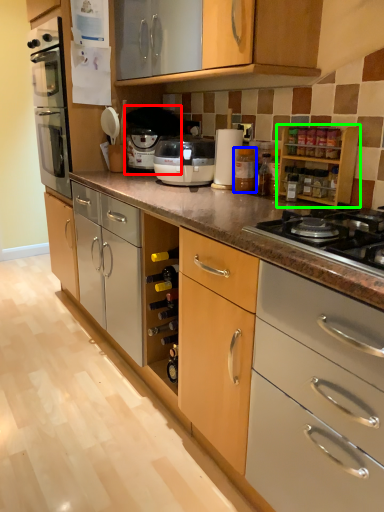
Question: Considering the real-world distances, which object is farthest from coffee machine (highlighted by a red box)? bottle (highlighted by a blue box) or cabinetry (highlighted by a green box)?

Choices:
 (A) bottle
 (B) cabinetry

Answer: (B)